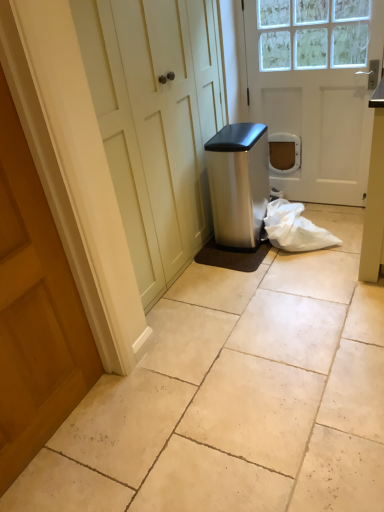
Question: Is beige tile floor at center looking in the opposite direction of wooden door at left, which is the second door in back-to-front order?

Choices:
 (A) no
 (B) yes

Answer: (A)

Question: Considering the relative sizes of beige tile floor at center and wooden door at left, the 1th door from the bottom, in the image provided, is beige tile floor at center shorter than wooden door at left, the 1th door from the bottom,?

Choices:
 (A) no
 (B) yes

Answer: (B)

Question: Does beige tile floor at center have a greater height compared to wooden door at left, the 1th door from the bottom?

Choices:
 (A) yes
 (B) no

Answer: (B)

Question: From a real-world perspective, is beige tile floor at center physically above wooden door at left, the second door in the right-to-left sequence?

Choices:
 (A) no
 (B) yes

Answer: (A)

Question: From the image's perspective, does beige tile floor at center appear lower than wooden door at left, the second door in the top-to-bottom sequence?

Choices:
 (A) yes
 (B) no

Answer: (A)

Question: Is beige tile floor at center behind wooden door at left, the 1th door from the bottom?

Choices:
 (A) no
 (B) yes

Answer: (B)

Question: Can you confirm if beige tile floor at center is positioned to the right of satin silver trash can at center?

Choices:
 (A) no
 (B) yes

Answer: (B)

Question: Is beige tile floor at center positioned behind satin silver trash can at center?

Choices:
 (A) yes
 (B) no

Answer: (B)

Question: From a real-world perspective, is beige tile floor at center under satin silver trash can at center?

Choices:
 (A) yes
 (B) no

Answer: (A)

Question: Is beige tile floor at center touching satin silver trash can at center?

Choices:
 (A) no
 (B) yes

Answer: (A)

Question: Considering the relative sizes of beige tile floor at center and satin silver trash can at center in the image provided, is beige tile floor at center thinner than satin silver trash can at center?

Choices:
 (A) yes
 (B) no

Answer: (B)

Question: Does beige tile floor at center have a greater width compared to satin silver trash can at center?

Choices:
 (A) no
 (B) yes

Answer: (B)

Question: Is white matte door at center, acting as the second door starting from the bottom, not near satin silver trash can at center?

Choices:
 (A) no
 (B) yes

Answer: (A)